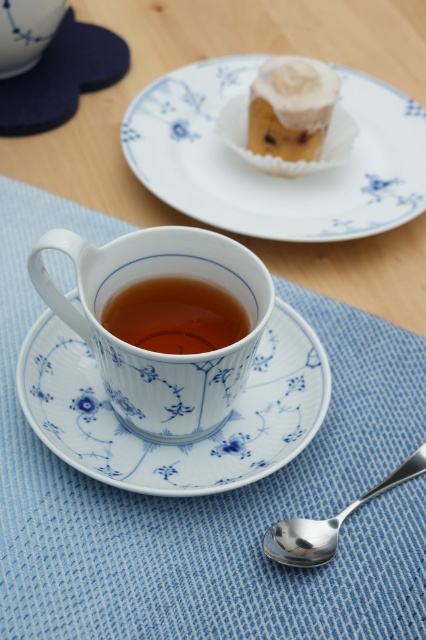
You are a tea lover who wants to place a new cup next to your existing cups. You have a new cup that is 3 inches wide. Can you fit it between the white porcelain cup at center and the brown glossy cup at center without moving them?

The distance between the white porcelain cup at center and the brown glossy cup at center is 2.79 inches. Since the new cup is 3 inches wide, it cannot fit in the space between them without moving the existing cups.

You are a guest at a tea ceremony and see both the white porcelain cup at center and the brown glossy cup at center on the table. Which cup is taller?

The white porcelain cup at center is much taller than the brown glossy cup at center.